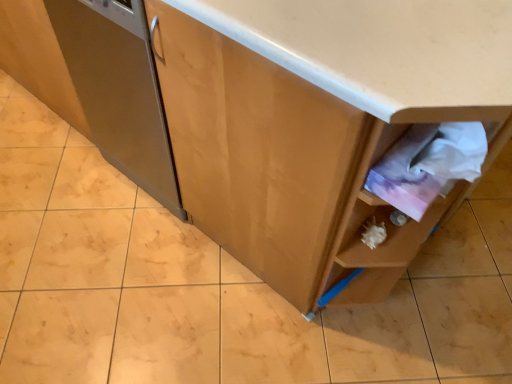
The image size is (512, 384). Find the location of `vacant space in front of matte wood cabinet at left`. vacant space in front of matte wood cabinet at left is located at coordinates (124, 256).